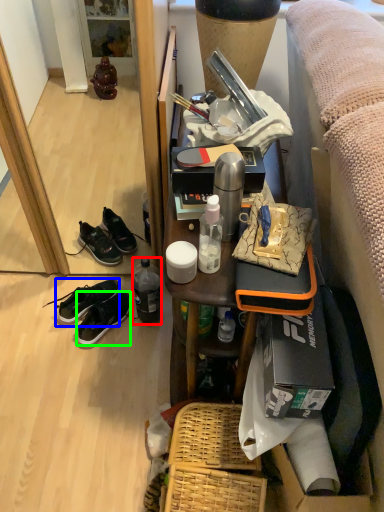
Question: Based on their relative distances, which object is nearer to bottle (highlighted by a red box)? Choose from shoe (highlighted by a blue box) and sneakers (highlighted by a green box).

Choices:
 (A) shoe
 (B) sneakers

Answer: (B)